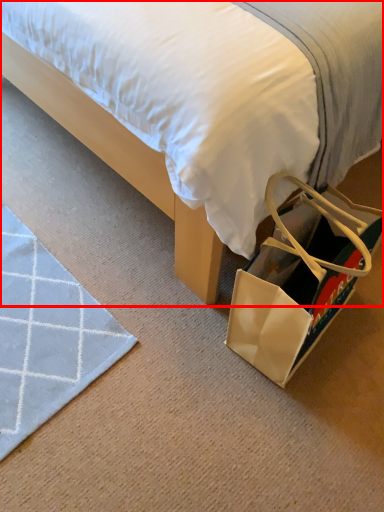
Question: Where is bed (annotated by the red box) located in relation to shoulder bag in the image?

Choices:
 (A) left
 (B) right

Answer: (A)